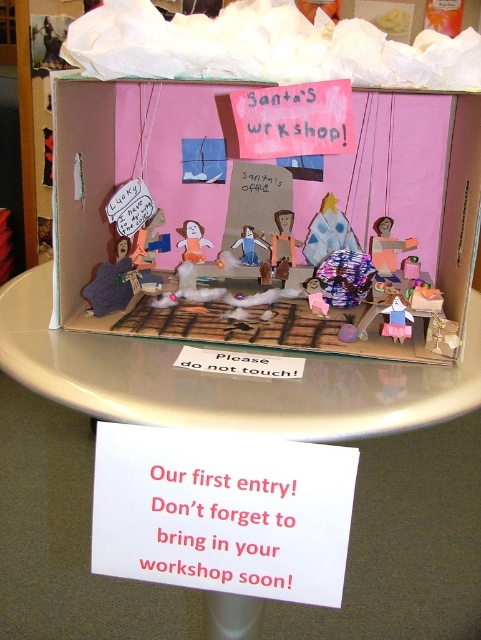
You are a photographer standing at a certain distance from the pink cardboard box at center. You want to capture a clear photo of the box without any blur. The camera requires a minimum focus distance of 25 inches. Can you take the photo without moving closer?

The distance between the pink cardboard box at center and the camera is 24.76 inches, which is less than the camera minimum focus distance of 25 inches. Therefore, you cannot take a clear photo without moving closer to ensure the distance meets or exceeds 25 inches.

You are a visitor at a school fair and see the Santa Workshop display. You want to take a photo of the white glossy table at center without the pink cardboard box at center blocking the view. Is this possible?

The white glossy table at center is behind the pink cardboard box at center, so it is blocked from view. Therefore, you cannot take a photo of the white glossy table at center without the pink cardboard box at center blocking the view.